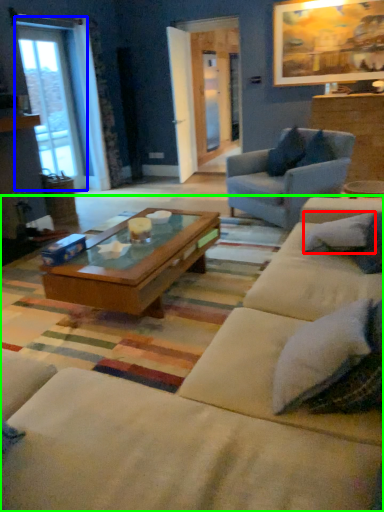
Question: Considering the real-world distances, which object is farthest from pillow (highlighted by a red box)? window (highlighted by a blue box) or studio couch (highlighted by a green box)?

Choices:
 (A) window
 (B) studio couch

Answer: (A)